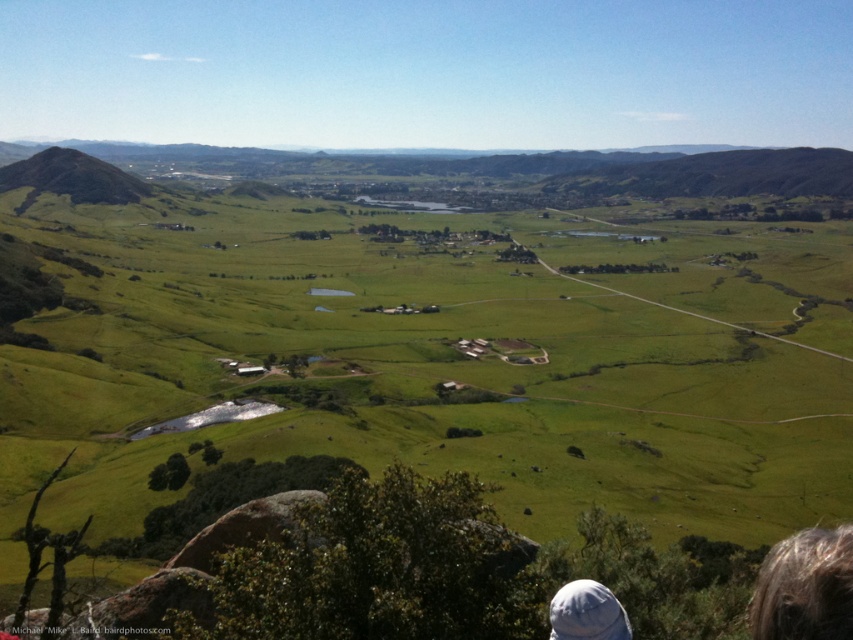
Between dark brown hair at lower right and green grassy hill at left, which one has more height?

Standing taller between the two is green grassy hill at left.

Does dark brown hair at lower right have a greater width compared to green grassy hill at left?

No, dark brown hair at lower right is not wider than green grassy hill at left.

Is point (751, 602) in front of point (44, 173)?

Yes, it is.

Where is `dark brown hair at lower right`? The image size is (853, 640). dark brown hair at lower right is located at coordinates (805, 588).

Can you confirm if green grassy hill at left is smaller than white fabric cap at lower right?

Actually, green grassy hill at left might be larger than white fabric cap at lower right.

Describe the element at coordinates (71, 177) in the screenshot. I see `green grassy hill at left` at that location.

Where is `green grassy hill at left`? green grassy hill at left is located at coordinates (71, 177).

Does point (769, 577) come farther from viewer compared to point (631, 636)?

No, it is not.

The width and height of the screenshot is (853, 640). What do you see at coordinates (805, 588) in the screenshot?
I see `dark brown hair at lower right` at bounding box center [805, 588].

This screenshot has height=640, width=853. Find the location of `dark brown hair at lower right`. dark brown hair at lower right is located at coordinates (805, 588).

This screenshot has height=640, width=853. I want to click on dark brown hair at lower right, so click(x=805, y=588).